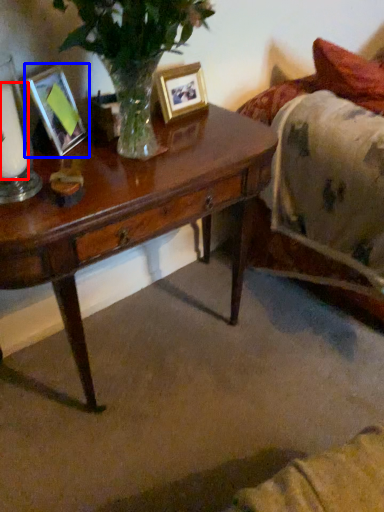
Question: Which object is further to the camera taking this photo, candle (highlighted by a red box) or picture frame (highlighted by a blue box)?

Choices:
 (A) candle
 (B) picture frame

Answer: (B)